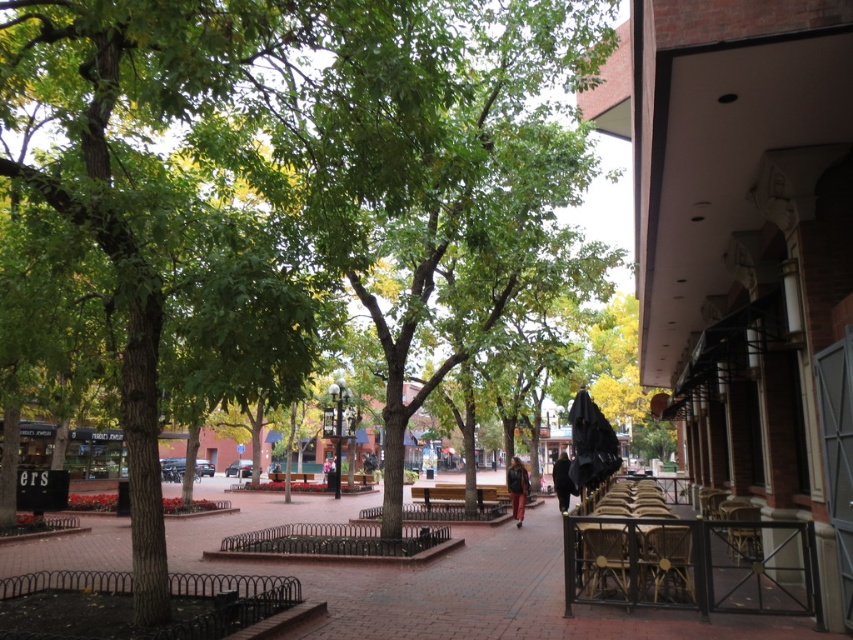
Between rattan chair at lower right and wooden park bench at center, which one has more height?

rattan chair at lower right is taller.

Describe the element at coordinates (666, 561) in the screenshot. The height and width of the screenshot is (640, 853). I see `rattan chair at lower right` at that location.

Is point (641, 556) farther from camera compared to point (459, 496)?

No, (641, 556) is in front of (459, 496).

The image size is (853, 640). I want to click on rattan chair at lower right, so click(x=666, y=561).

Which is more to the left, brick pavement at center or wooden park bench at center?

Positioned to the left is brick pavement at center.

Which is below, brick pavement at center or wooden park bench at center?

Result: brick pavement at center is lower down.

At what (x,y) coordinates should I click in order to perform the action: click on brick pavement at center. Please return your answer as a coordinate pair (x, y). Image resolution: width=853 pixels, height=640 pixels. Looking at the image, I should click on (450, 580).

In the scene shown: Does wooden table at lower right have a greater height compared to matte black jacket at center?

Correct, wooden table at lower right is much taller as matte black jacket at center.

Which is behind, point (595, 557) or point (523, 465)?

The point (523, 465) is more distant.

The width and height of the screenshot is (853, 640). Find the location of `wooden table at lower right`. wooden table at lower right is located at coordinates (630, 561).